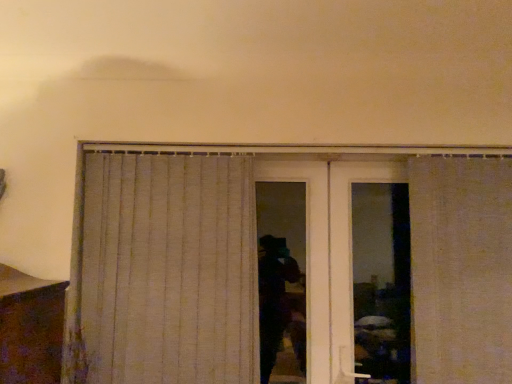
Find the location of a particular element. This screenshot has width=512, height=384. white textured curtain at right, which ranks as the 2th curtain in left-to-right order is located at coordinates (461, 269).

This screenshot has width=512, height=384. Describe the element at coordinates (461, 269) in the screenshot. I see `white textured curtain at right, which ranks as the 2th curtain in left-to-right order` at that location.

The height and width of the screenshot is (384, 512). Find the location of `beige fabric curtain at center, which is the 2th curtain in right-to-left order`. beige fabric curtain at center, which is the 2th curtain in right-to-left order is located at coordinates (169, 269).

What is the approximate width of beige fabric curtain at center, the 1th curtain positioned from the left?

2.51 inches.

Describe the element at coordinates (169, 269) in the screenshot. I see `beige fabric curtain at center, the 1th curtain positioned from the left` at that location.

Identify the location of white textured curtain at right, which is the 1th curtain in right-to-left order. The height and width of the screenshot is (384, 512). (461, 269).

Between white textured curtain at right, which is the 1th curtain in right-to-left order, and beige fabric curtain at center, the 1th curtain positioned from the left, which one appears on the right side from the viewer's perspective?

white textured curtain at right, which is the 1th curtain in right-to-left order, is more to the right.

Relative to beige fabric curtain at center, which is the 2th curtain in right-to-left order, is white textured curtain at right, which ranks as the 2th curtain in left-to-right order, in front or behind?

white textured curtain at right, which ranks as the 2th curtain in left-to-right order, is in front of beige fabric curtain at center, which is the 2th curtain in right-to-left order.

Which is closer to the camera, (504, 251) or (100, 225)?

Point (504, 251) appears to be closer to the viewer than point (100, 225).

From the image's perspective, between white textured curtain at right, which is the 1th curtain in right-to-left order, and beige fabric curtain at center, the 1th curtain positioned from the left, who is located below?

From the image's view, white textured curtain at right, which is the 1th curtain in right-to-left order, is below.

From a real-world perspective, which object rests below the other?

beige fabric curtain at center, which is the 2th curtain in right-to-left order, from a real-world perspective.

Can you confirm if white textured curtain at right, which ranks as the 2th curtain in left-to-right order, is wider than beige fabric curtain at center, the 1th curtain positioned from the left?

Indeed, white textured curtain at right, which ranks as the 2th curtain in left-to-right order, has a greater width compared to beige fabric curtain at center, the 1th curtain positioned from the left.

Considering the sizes of white textured curtain at right, which ranks as the 2th curtain in left-to-right order, and beige fabric curtain at center, the 1th curtain positioned from the left, in the image, is white textured curtain at right, which ranks as the 2th curtain in left-to-right order, taller or shorter than beige fabric curtain at center, the 1th curtain positioned from the left,?

In the image, white textured curtain at right, which ranks as the 2th curtain in left-to-right order, appears to be shorter than beige fabric curtain at center, the 1th curtain positioned from the left.

Looking at the image, does white textured curtain at right, which is the 1th curtain in right-to-left order, seem bigger or smaller compared to beige fabric curtain at center, which is the 2th curtain in right-to-left order?

Clearly, white textured curtain at right, which is the 1th curtain in right-to-left order, is larger in size than beige fabric curtain at center, which is the 2th curtain in right-to-left order.

Is white textured curtain at right, which is the 1th curtain in right-to-left order, located outside beige fabric curtain at center, the 1th curtain positioned from the left?

Yes.

Is white textured curtain at right, which is the 1th curtain in right-to-left order, in contact with beige fabric curtain at center, which is the 2th curtain in right-to-left order?

No, white textured curtain at right, which is the 1th curtain in right-to-left order, is not in contact with beige fabric curtain at center, which is the 2th curtain in right-to-left order.

Is white textured curtain at right, which is the 1th curtain in right-to-left order, oriented away from beige fabric curtain at center, which is the 2th curtain in right-to-left order?

No.

How much distance is there between white textured curtain at right, which ranks as the 2th curtain in left-to-right order, and beige fabric curtain at center, the 1th curtain positioned from the left?

The distance of white textured curtain at right, which ranks as the 2th curtain in left-to-right order, from beige fabric curtain at center, the 1th curtain positioned from the left, is 1.02 meters.

Find the location of a particular element. This screenshot has height=384, width=512. curtain on the left of the white textured curtain at right, which is the 1th curtain in right-to-left order is located at coordinates (169, 269).

Considering the positions of objects beige fabric curtain at center, the 1th curtain positioned from the left, and white textured curtain at right, which ranks as the 2th curtain in left-to-right order, in the image provided, who is more to the right, beige fabric curtain at center, the 1th curtain positioned from the left, or white textured curtain at right, which ranks as the 2th curtain in left-to-right order,?

white textured curtain at right, which ranks as the 2th curtain in left-to-right order.

Consider the image. Considering their positions, is beige fabric curtain at center, which is the 2th curtain in right-to-left order, located in front of or behind white textured curtain at right, which ranks as the 2th curtain in left-to-right order?

beige fabric curtain at center, which is the 2th curtain in right-to-left order, is positioned farther from the viewer than white textured curtain at right, which ranks as the 2th curtain in left-to-right order.

Is point (148, 319) closer or farther from the camera than point (451, 348)?

Point (148, 319) is positioned farther from the camera compared to point (451, 348).

From the image's perspective, is beige fabric curtain at center, the 1th curtain positioned from the left, on white textured curtain at right, which is the 1th curtain in right-to-left order?

Yes, from the image's perspective, beige fabric curtain at center, the 1th curtain positioned from the left, is on top of white textured curtain at right, which is the 1th curtain in right-to-left order.

From a real-world perspective, relative to white textured curtain at right, which is the 1th curtain in right-to-left order, is beige fabric curtain at center, which is the 2th curtain in right-to-left order, vertically above or below?

beige fabric curtain at center, which is the 2th curtain in right-to-left order, is situated lower than white textured curtain at right, which is the 1th curtain in right-to-left order, in the real world.

Between beige fabric curtain at center, which is the 2th curtain in right-to-left order, and white textured curtain at right, which ranks as the 2th curtain in left-to-right order, which one has smaller width?

beige fabric curtain at center, which is the 2th curtain in right-to-left order.

Is beige fabric curtain at center, which is the 2th curtain in right-to-left order, shorter than white textured curtain at right, which is the 1th curtain in right-to-left order?

In fact, beige fabric curtain at center, which is the 2th curtain in right-to-left order, may be taller than white textured curtain at right, which is the 1th curtain in right-to-left order.

Consider the image. Is beige fabric curtain at center, the 1th curtain positioned from the left, bigger than white textured curtain at right, which is the 1th curtain in right-to-left order?

Incorrect, beige fabric curtain at center, the 1th curtain positioned from the left, is not larger than white textured curtain at right, which is the 1th curtain in right-to-left order.

Is beige fabric curtain at center, which is the 2th curtain in right-to-left order, located outside white textured curtain at right, which is the 1th curtain in right-to-left order?

Indeed, beige fabric curtain at center, which is the 2th curtain in right-to-left order, is completely outside white textured curtain at right, which is the 1th curtain in right-to-left order.

Is beige fabric curtain at center, which is the 2th curtain in right-to-left order, next to white textured curtain at right, which is the 1th curtain in right-to-left order?

No, beige fabric curtain at center, which is the 2th curtain in right-to-left order, is not making contact with white textured curtain at right, which is the 1th curtain in right-to-left order.

Is beige fabric curtain at center, which is the 2th curtain in right-to-left order, turned away from white textured curtain at right, which is the 1th curtain in right-to-left order?

beige fabric curtain at center, which is the 2th curtain in right-to-left order, is not turned away from white textured curtain at right, which is the 1th curtain in right-to-left order.

Can you tell me how much beige fabric curtain at center, the 1th curtain positioned from the left, and white textured curtain at right, which ranks as the 2th curtain in left-to-right order, differ in facing direction?

The facing directions of beige fabric curtain at center, the 1th curtain positioned from the left, and white textured curtain at right, which ranks as the 2th curtain in left-to-right order, are 0.183 degrees apart.

In order to click on curtain located above the beige fabric curtain at center, which is the 2th curtain in right-to-left order (from a real-world perspective) in this screenshot , I will do `click(461, 269)`.

Locate an element on the screen. This screenshot has width=512, height=384. curtain that appears below the beige fabric curtain at center, which is the 2th curtain in right-to-left order (from the image's perspective) is located at coordinates (461, 269).

Locate an element on the screen. This screenshot has height=384, width=512. curtain behind the white textured curtain at right, which is the 1th curtain in right-to-left order is located at coordinates (169, 269).